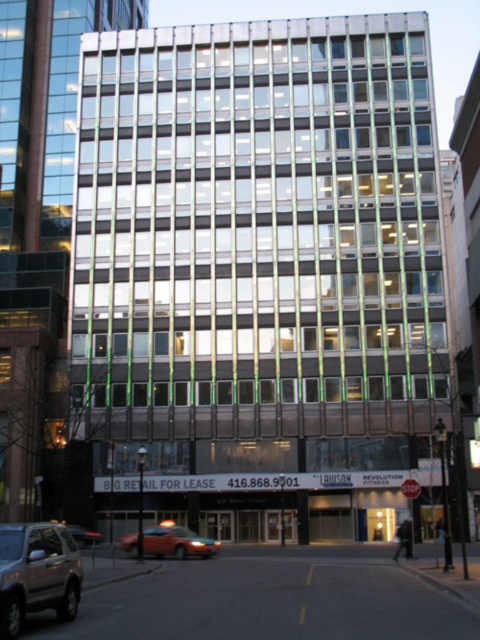
Question: Is silver metallic suv at lower left to the right of orange matte taxi at lower left from the viewer's perspective?

Choices:
 (A) no
 (B) yes

Answer: (B)

Question: Which object is positioned closest to the metallic silver taxi at lower left?

Choices:
 (A) silver metallic suv at lower left
 (B) orange matte taxi at lower left

Answer: (B)

Question: Which of the following is the farthest from the observer?

Choices:
 (A) (91, 545)
 (B) (156, 529)

Answer: (A)

Question: Among these objects, which one is nearest to the camera?

Choices:
 (A) silver metallic suv at lower left
 (B) metallic silver taxi at lower left
 (C) orange matte taxi at lower left

Answer: (A)

Question: Is orange matte taxi at lower left wider than metallic silver taxi at lower left?

Choices:
 (A) no
 (B) yes

Answer: (B)

Question: Does silver metallic suv at lower left appear over orange matte taxi at lower left?

Choices:
 (A) no
 (B) yes

Answer: (B)